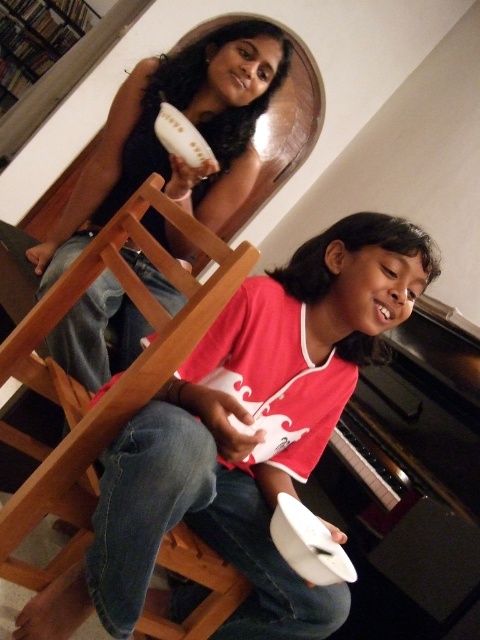
The image size is (480, 640). Find the location of `white matte plate at center`. white matte plate at center is located at coordinates (244, 435).

Between white matte plate at center and matte black hairbrush at upper center, which one appears on the left side from the viewer's perspective?

matte black hairbrush at upper center

In order to click on white matte plate at center in this screenshot , I will do `click(244, 435)`.